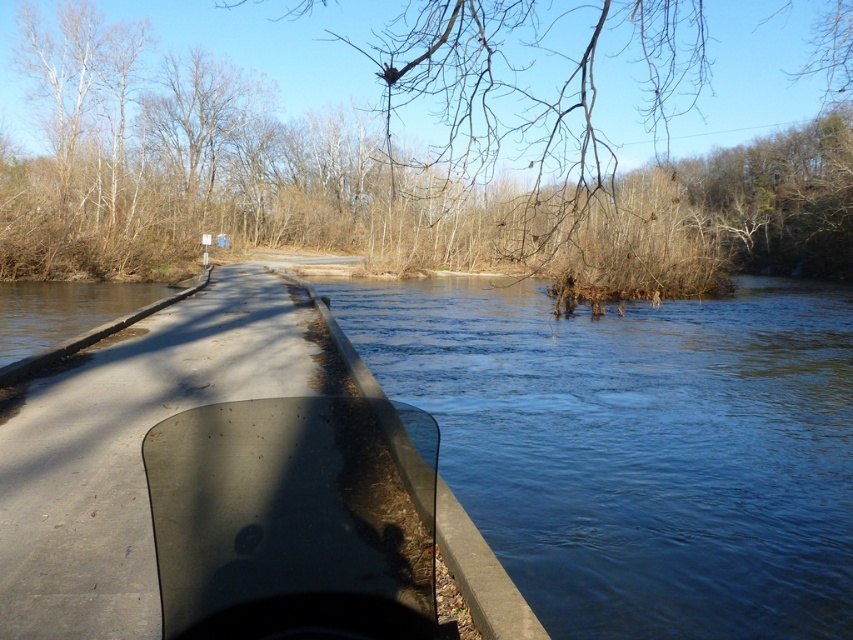
Is brown leafless branches at upper center closer to the viewer compared to transparent plastic boat at center?

No.

Based on the photo, is brown leafless branches at upper center shorter than transparent plastic boat at center?

Incorrect, brown leafless branches at upper center's height does not fall short of transparent plastic boat at center's.

Is point (109, 176) closer to viewer compared to point (71, 404)?

No, (109, 176) is behind (71, 404).

Find the location of `brown leafless branches at upper center`. brown leafless branches at upper center is located at coordinates (413, 157).

Does brown leafless branches at upper center have a lesser height compared to clear blue water at center?

No.

Who is more distant from viewer, (386,74) or (653,529)?

Positioned behind is point (653,529).

Describe the element at coordinates (413, 157) in the screenshot. I see `brown leafless branches at upper center` at that location.

This screenshot has height=640, width=853. In order to click on brown leafless branches at upper center in this screenshot , I will do `click(413, 157)`.

At what (x,y) coordinates should I click in order to perform the action: click on clear blue water at center. Please return your answer as a coordinate pair (x, y). Looking at the image, I should click on (637, 448).

Does clear blue water at center have a larger size compared to transparent plastic boat at center?

Yes.

Which is behind, point (508, 529) or point (299, 531)?

Point (508, 529)

In order to click on clear blue water at center in this screenshot , I will do `click(637, 448)`.